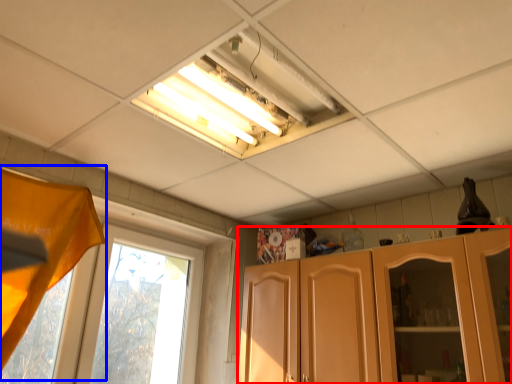
Question: Which of the following is the farthest to the observer, cabinetry (highlighted by a red box) or curtain (highlighted by a blue box)?

Choices:
 (A) cabinetry
 (B) curtain

Answer: (A)